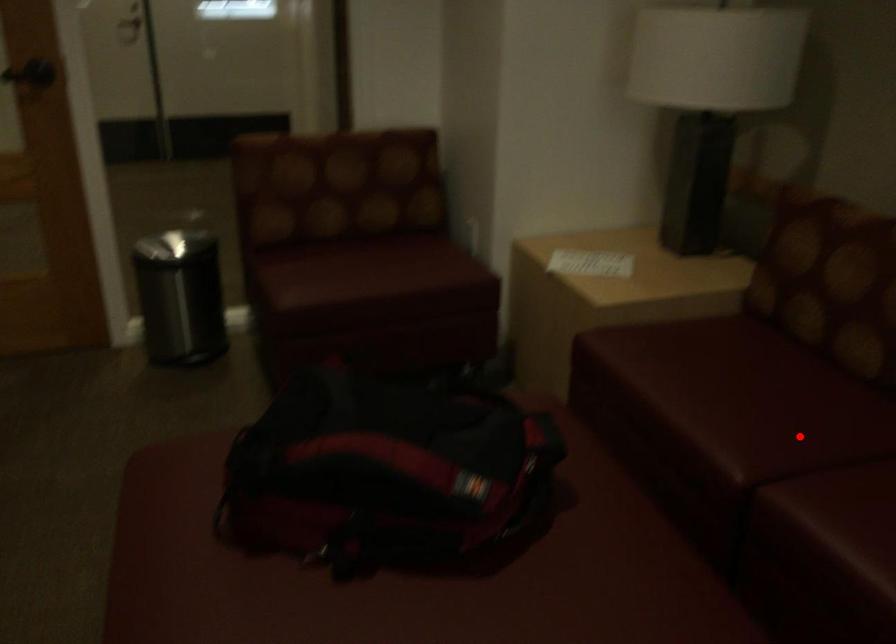
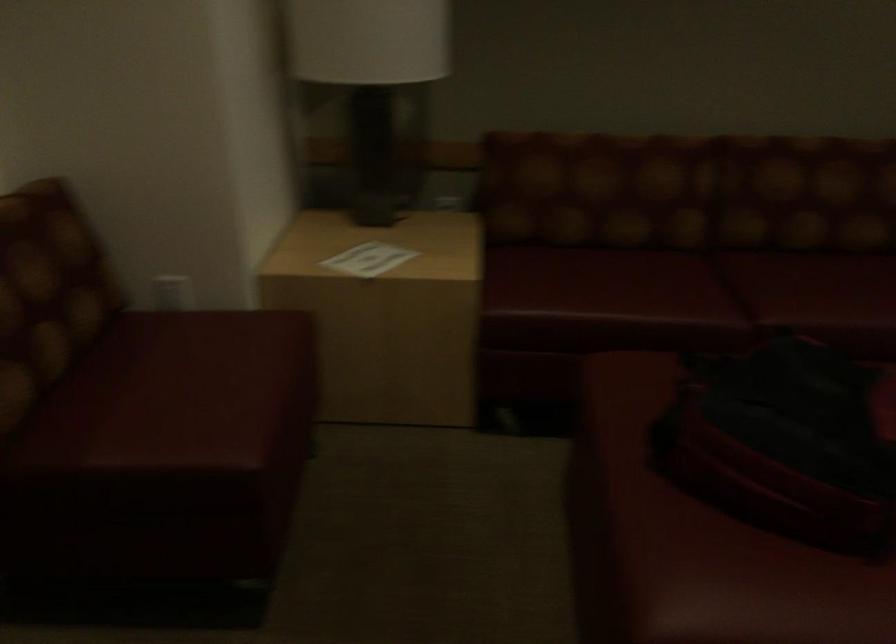
Question: A red point is marked in image1. In image2, is the corresponding 3D point closer to the camera or farther? Reply with the corresponding letter.

Choices:
 (A) The corresponding 3D point is closer.
 (B) The corresponding 3D point is farther.

Answer: (B)